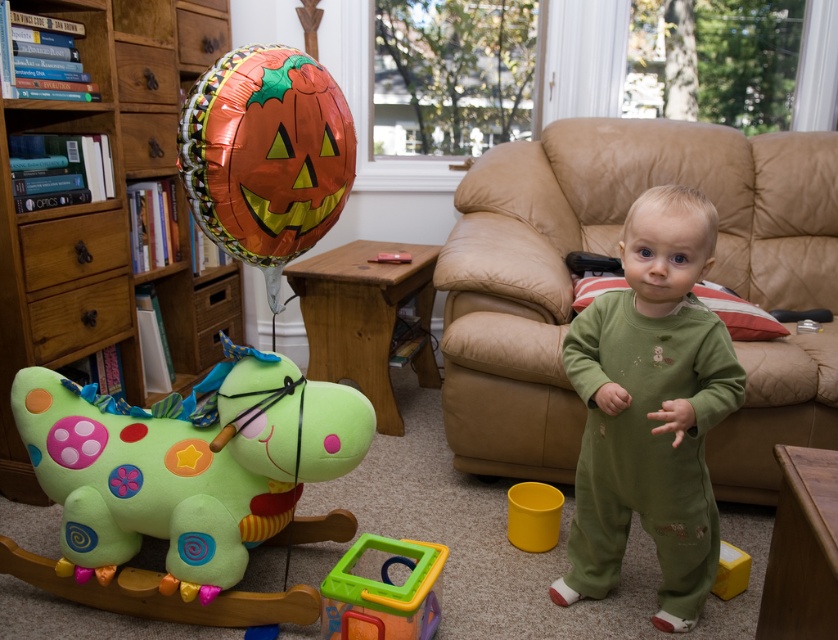
Question: From the image, what is the correct spatial relationship of soft plush horse at left in relation to orange metallic balloon at upper left?

Choices:
 (A) below
 (B) above

Answer: (A)

Question: Can you confirm if green plush rocking horse at lower left is wider than orange metallic balloon at upper left?

Choices:
 (A) yes
 (B) no

Answer: (A)

Question: Which object appears farthest from the camera in this image?

Choices:
 (A) orange metallic balloon at upper left
 (B) translucent plastic cube at lower center

Answer: (B)

Question: Which of these objects is positioned closest to the translucent plastic cube at lower center?

Choices:
 (A) orange metallic balloon at upper left
 (B) green soft onesie at center
 (C) green plush rocking horse at lower left
 (D) soft plush horse at left

Answer: (D)

Question: Which point appears farthest from the camera in this image?

Choices:
 (A) (216, 140)
 (B) (818, 211)
 (C) (593, 320)

Answer: (B)

Question: Does orange metallic balloon at upper left appear over translucent plastic cube at lower center?

Choices:
 (A) yes
 (B) no

Answer: (A)